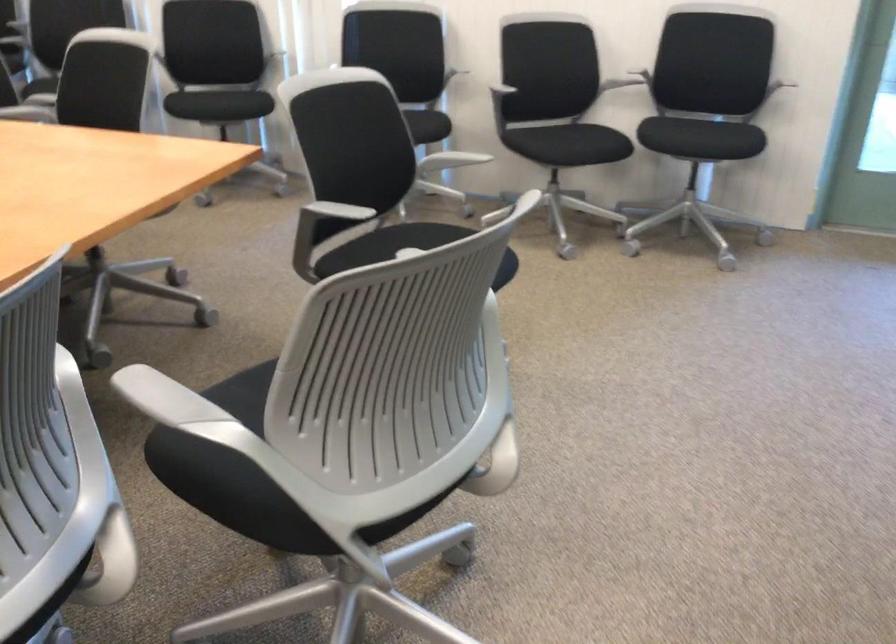
The width and height of the screenshot is (896, 644). Find the location of `gray adjustment knob`. gray adjustment knob is located at coordinates (496, 448).